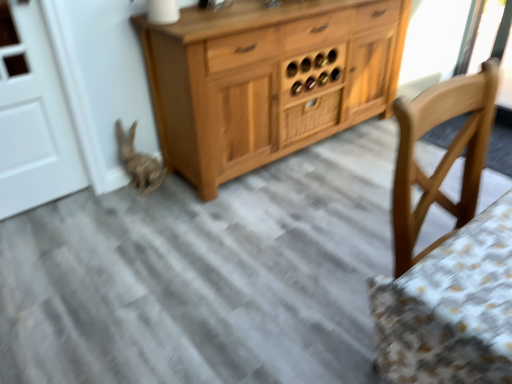
You are a GUI agent. You are given a task and a screenshot of the screen. Output one action in this format:
    pyautogui.click(x=<x>, y=<y>)
    Task: Click on the free spot above wooden drawer at center (from a real-world perspective)
    The width and height of the screenshot is (512, 384).
    Given the screenshot: What is the action you would take?
    pyautogui.click(x=313, y=94)